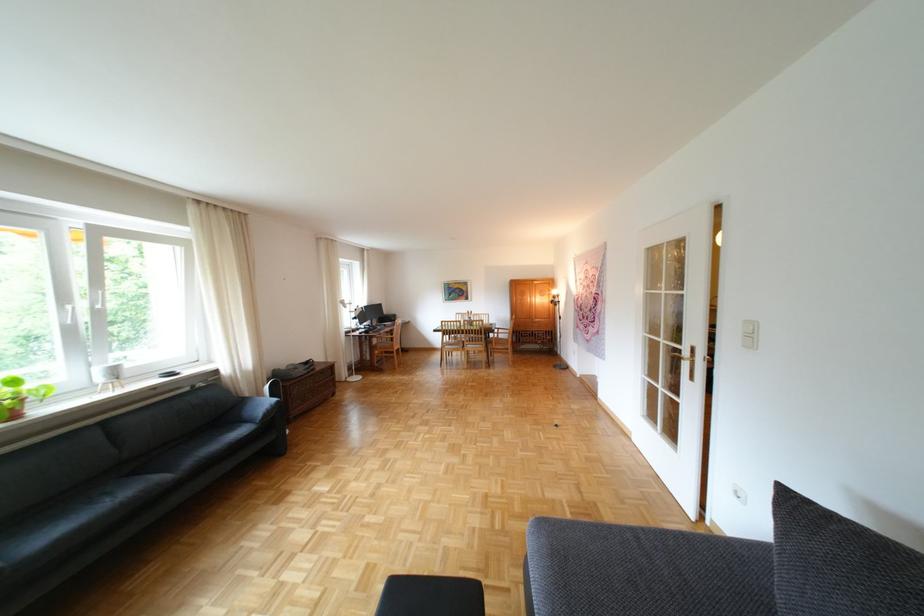
Find where to rest the dark sofa armrest. Please return your answer as a coordinate pair (x, y).

(251, 410)